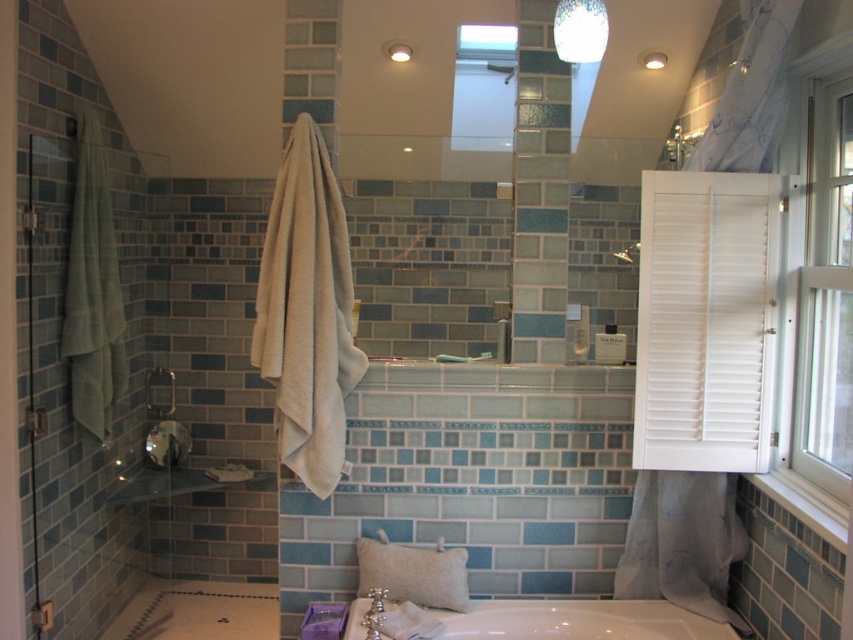
Question: Which of the following is the farthest from the observer?

Choices:
 (A) (590, 627)
 (B) (810, 454)

Answer: (A)

Question: Considering the relative positions of white glossy bathtub at center and matte white shower at upper center in the image provided, where is white glossy bathtub at center located with respect to matte white shower at upper center?

Choices:
 (A) below
 (B) above

Answer: (A)

Question: Is white glossy bathtub at center smaller than beige fabric pillow at lower center?

Choices:
 (A) yes
 (B) no

Answer: (B)

Question: Which point is farther from the camera taking this photo?

Choices:
 (A) (842, 381)
 (B) (740, 253)
 (C) (445, 563)
 (D) (560, 609)

Answer: (D)

Question: Which point is closer to the camera?

Choices:
 (A) [x=426, y=554]
 (B) [x=850, y=64]

Answer: (B)

Question: Does white matte shutter at right have a lesser width compared to beige fabric pillow at lower center?

Choices:
 (A) no
 (B) yes

Answer: (A)